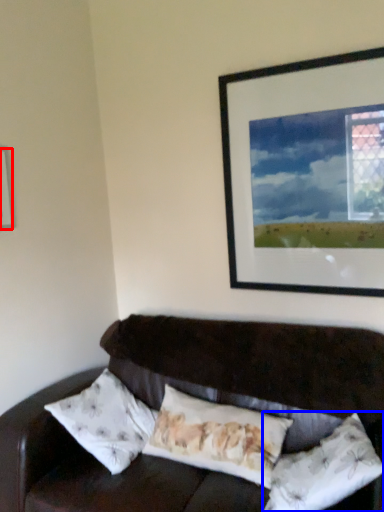
Question: Which point is further to the camera, picture frame (highlighted by a red box) or pillow (highlighted by a blue box)?

Choices:
 (A) picture frame
 (B) pillow

Answer: (A)